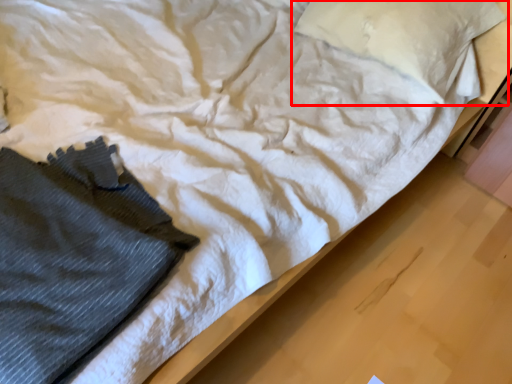
Question: From the image's perspective, where is pillow (annotated by the red box) located relative to clothing?

Choices:
 (A) above
 (B) below

Answer: (A)